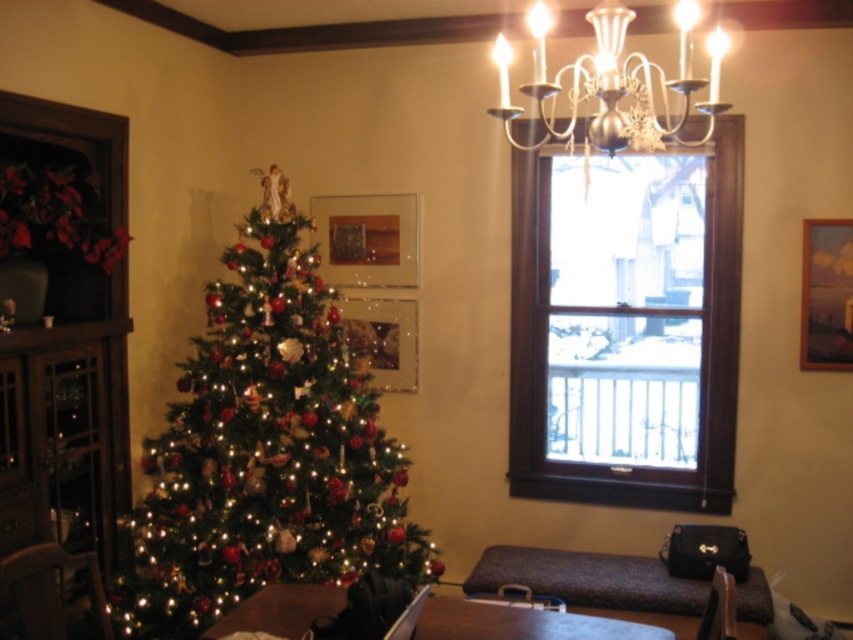
Question: Which object is farther from the camera taking this photo?

Choices:
 (A) wooden frame at upper right
 (B) wooden table at lower center

Answer: (A)

Question: Which is nearer to the silver metallic chandelier at upper center?

Choices:
 (A) wooden chair at lower right
 (B) matte brown chair at lower left
 (C) shiny green christmas tree at center

Answer: (C)

Question: Estimate the real-world distances between objects in this image. Which object is closer to the wooden frame at upper right?

Choices:
 (A) matte brown chair at lower left
 (B) shiny green christmas tree at center
 (C) wooden chair at lower right
 (D) silver metallic chandelier at upper center

Answer: (D)

Question: Can you confirm if shiny green christmas tree at center is bigger than wooden chair at lower right?

Choices:
 (A) no
 (B) yes

Answer: (B)

Question: Is wooden frame at upper right closer to the viewer compared to silver metallic chandelier at upper center?

Choices:
 (A) yes
 (B) no

Answer: (B)

Question: Is shiny green christmas tree at center to the left of wooden chair at lower right from the viewer's perspective?

Choices:
 (A) yes
 (B) no

Answer: (A)